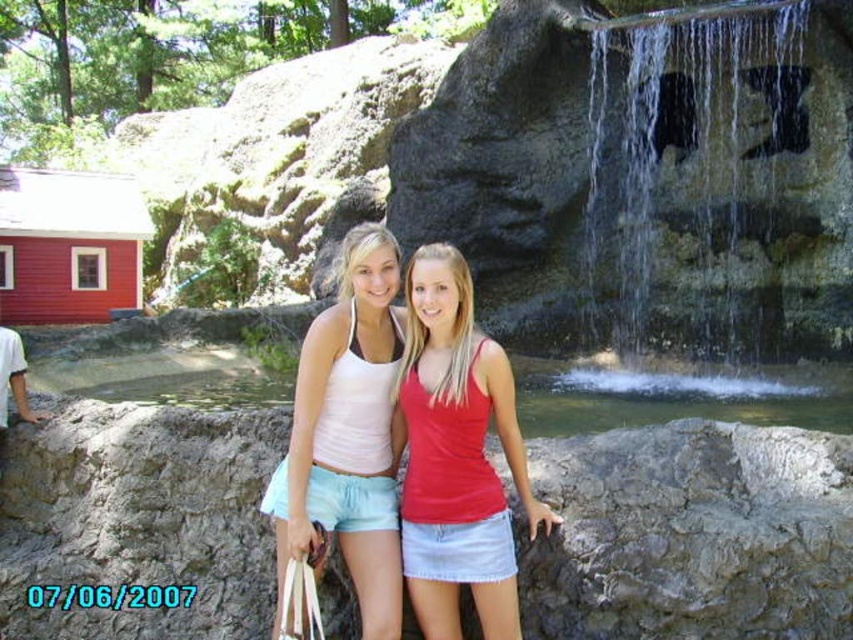
Question: Can you confirm if matte red tank top at center is positioned to the right of white cotton shirt at left?

Choices:
 (A) yes
 (B) no

Answer: (A)

Question: Which point appears farthest from the camera in this image?

Choices:
 (A) (468, 544)
 (B) (718, 321)
 (C) (22, 372)

Answer: (B)

Question: Which of these objects is positioned closest to the matte red tank top at center?

Choices:
 (A) gray stone at center
 (B) matte white tank top at center
 (C) clear water at center right

Answer: (B)

Question: Which point appears closest to the camera in this image?

Choices:
 (A) (22, 404)
 (B) (370, 224)
 (C) (694, 419)
 (D) (469, 506)

Answer: (D)

Question: From the image, what is the correct spatial relationship of clear water at center right in relation to white cotton shirt at left?

Choices:
 (A) right
 (B) left

Answer: (A)

Question: Is clear water at center right smaller than matte white tank top at center?

Choices:
 (A) no
 (B) yes

Answer: (B)